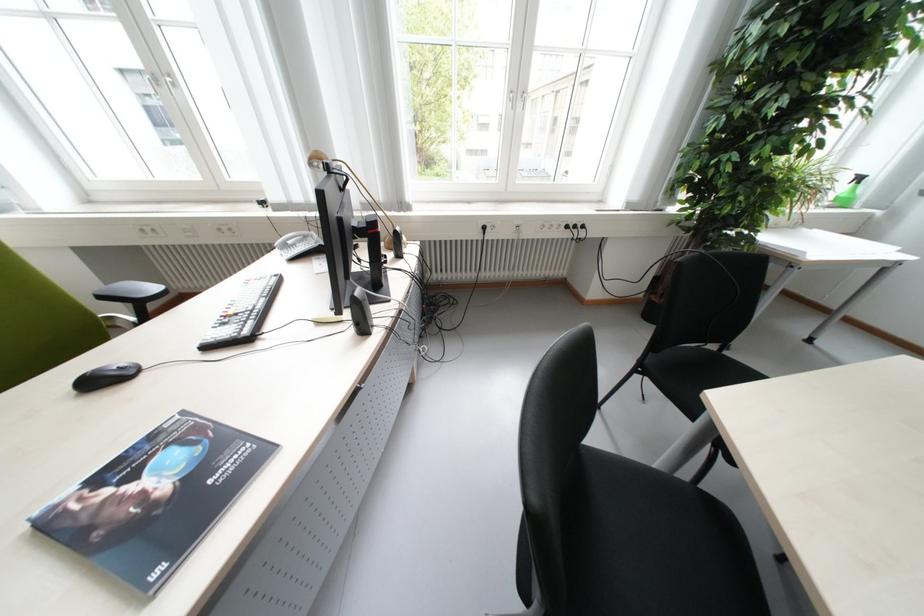
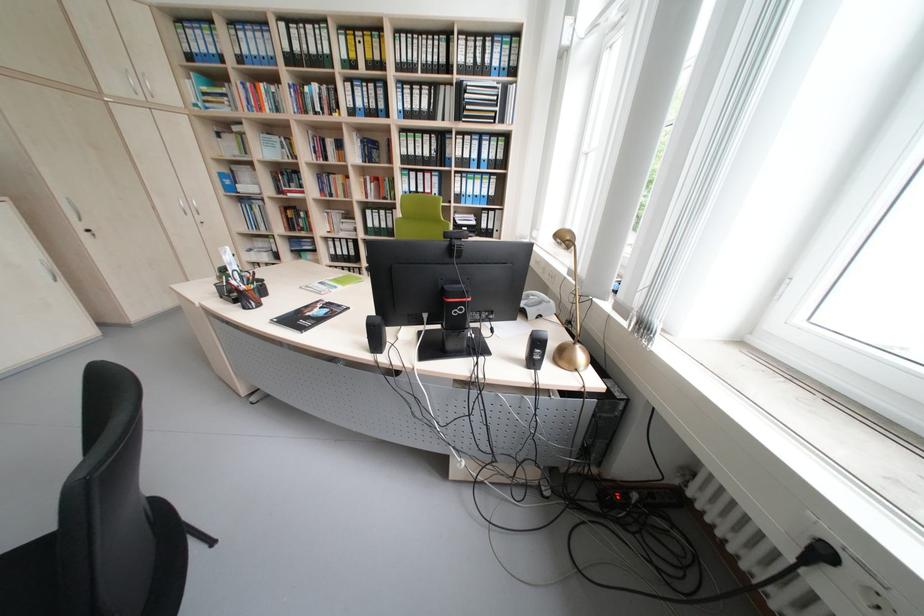
Locate, in the second image, the point that corresponds to point (494, 230) in the first image.

(833, 554)